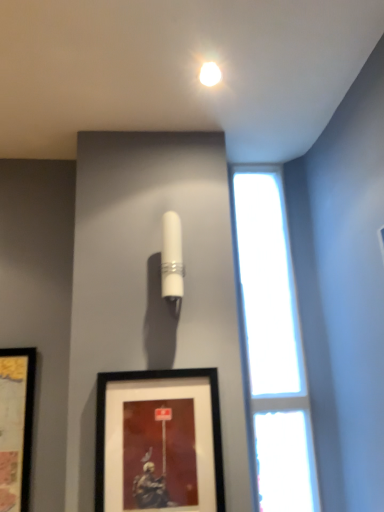
In order to face transparent glass window at right, should I rotate leftwards or rightwards?

To align with it, rotate right about 10.662°.

The height and width of the screenshot is (512, 384). Describe the element at coordinates (159, 441) in the screenshot. I see `black matte picture frame at lower center` at that location.

You are a GUI agent. You are given a task and a screenshot of the screen. Output one action in this format:
    pyautogui.click(x=<x>, y=<y>)
    Task: Click on the matte white light bulb at upper center
    The height and width of the screenshot is (512, 384).
    Given the screenshot: What is the action you would take?
    pyautogui.click(x=210, y=74)

Image resolution: width=384 pixels, height=512 pixels. In order to click on white glossy cylinder at upper center in this screenshot , I will do `click(172, 262)`.

Does point (175, 225) lie behind point (156, 469)?

Yes, it is behind point (156, 469).

Based on the photo, is white glossy cylinder at upper center far away from black matte picture frame at lower center?

white glossy cylinder at upper center is actually quite close to black matte picture frame at lower center.

Based on the photo, is white glossy cylinder at upper center surrounding black matte picture frame at lower center?

No.

In the image, is white glossy cylinder at upper center on the left side or the right side of black matte picture frame at lower center?

Clearly, white glossy cylinder at upper center is on the right of black matte picture frame at lower center in the image.

Looking at this image, considering the relative positions of matte white light bulb at upper center and black matte picture frame at lower center in the image provided, is matte white light bulb at upper center to the left or to the right of black matte picture frame at lower center?

matte white light bulb at upper center is to the right of black matte picture frame at lower center.

From a real-world perspective, does matte white light bulb at upper center sit lower than black matte picture frame at lower center?

No, from a real-world perspective, matte white light bulb at upper center is not under black matte picture frame at lower center.

Is point (206, 74) closer to viewer compared to point (103, 451)?

No, it is behind (103, 451).

Between matte white light bulb at upper center and black matte picture frame at lower center, which one has smaller size?

matte white light bulb at upper center is smaller.

Considering the positions of objects transparent glass window at right and white glossy cylinder at upper center in the image provided, who is in front, transparent glass window at right or white glossy cylinder at upper center?

white glossy cylinder at upper center is in front.

Where is `lamp above the transparent glass window at right (from a real-world perspective)`? This screenshot has height=512, width=384. lamp above the transparent glass window at right (from a real-world perspective) is located at coordinates (172, 262).

Is transparent glass window at right inside or outside of white glossy cylinder at upper center?

transparent glass window at right is not inside white glossy cylinder at upper center, it's outside.

Is transparent glass window at right next to matte white light bulb at upper center and touching it?

transparent glass window at right and matte white light bulb at upper center are not in contact.

Consider the image. Is transparent glass window at right inside the boundaries of matte white light bulb at upper center, or outside?

transparent glass window at right is located beyond the bounds of matte white light bulb at upper center.

From a real-world perspective, is transparent glass window at right physically located above or below matte white light bulb at upper center?

transparent glass window at right is situated lower than matte white light bulb at upper center in the real world.

Is transparent glass window at right in front of or behind matte white light bulb at upper center in the image?

transparent glass window at right is positioned farther from the viewer than matte white light bulb at upper center.

Which point is more forward, (274, 308) or (168, 453)?

The point (168, 453) is in front.

How far apart are transparent glass window at right and black matte picture frame at lower center?

A distance of 45.38 centimeters exists between transparent glass window at right and black matte picture frame at lower center.

I want to click on picture frame that appears below the transparent glass window at right (from the image's perspective), so click(x=159, y=441).

Considering the positions of objects transparent glass window at right and black matte picture frame at lower center in the image provided, who is more to the right, transparent glass window at right or black matte picture frame at lower center?

transparent glass window at right is more to the right.

Does matte white light bulb at upper center lie in front of white glossy cylinder at upper center?

Yes.

Find the location of a particular element. lighting located above the white glossy cylinder at upper center (from a real-world perspective) is located at coordinates click(x=210, y=74).

Would you say matte white light bulb at upper center is a long distance from white glossy cylinder at upper center?

No.

From a real-world perspective, is matte white light bulb at upper center physically above white glossy cylinder at upper center?

Yes.

The width and height of the screenshot is (384, 512). What are the coordinates of `picture frame on the left of matte white light bulb at upper center` in the screenshot? It's located at (159, 441).

Is black matte picture frame at lower center behind matte white light bulb at upper center?

That is False.

Is black matte picture frame at lower center far away from matte white light bulb at upper center?

Yes.

From a real-world perspective, is black matte picture frame at lower center on top of matte white light bulb at upper center?

No.

Where is `lamp lying above the black matte picture frame at lower center (from the image's perspective)`? The width and height of the screenshot is (384, 512). lamp lying above the black matte picture frame at lower center (from the image's perspective) is located at coordinates (172, 262).

Find the location of `lighting above the black matte picture frame at lower center (from a real-world perspective)`. lighting above the black matte picture frame at lower center (from a real-world perspective) is located at coordinates (210, 74).

Which object lies further to the anchor point black matte picture frame at lower center, white glossy cylinder at upper center or transparent glass window at right?

transparent glass window at right is further to black matte picture frame at lower center.

Looking at this image, considering their positions, is transparent glass window at right positioned closer to black matte picture frame at lower center than white glossy cylinder at upper center?

white glossy cylinder at upper center is closer to black matte picture frame at lower center.

In the scene shown: When comparing their distances from transparent glass window at right, does white glossy cylinder at upper center or black matte picture frame at lower center seem further?

white glossy cylinder at upper center lies further to transparent glass window at right than the other object.

Which object lies further to the anchor point matte white light bulb at upper center, transparent glass window at right or white glossy cylinder at upper center?

transparent glass window at right is further to matte white light bulb at upper center.

Based on their spatial positions, is black matte picture frame at lower center or transparent glass window at right further from matte white light bulb at upper center?

black matte picture frame at lower center is positioned further to the anchor matte white light bulb at upper center.

In the scene shown: Estimate the real-world distances between objects in this image. Which object is further from black matte picture frame at lower center, white glossy cylinder at upper center or matte white light bulb at upper center?

matte white light bulb at upper center is positioned further to the anchor black matte picture frame at lower center.

When comparing their distances from white glossy cylinder at upper center, does transparent glass window at right or black matte picture frame at lower center seem closer?

black matte picture frame at lower center is closer to white glossy cylinder at upper center.

In the scene shown: Based on their spatial positions, is black matte picture frame at lower center or matte white light bulb at upper center further from transparent glass window at right?

Based on the image, matte white light bulb at upper center appears to be further to transparent glass window at right.

Locate an element on the screen. The image size is (384, 512). window between matte white light bulb at upper center and black matte picture frame at lower center vertically is located at coordinates (273, 345).

This screenshot has height=512, width=384. Identify the location of lamp between matte white light bulb at upper center and transparent glass window at right in the vertical direction. (172, 262).

I want to click on window between white glossy cylinder at upper center and black matte picture frame at lower center in the up-down direction, so click(x=273, y=345).

You are a GUI agent. You are given a task and a screenshot of the screen. Output one action in this format:
    pyautogui.click(x=<x>, y=<y>)
    Task: Click on the lamp between matte white light bulb at upper center and black matte picture frame at lower center vertically
    
    Given the screenshot: What is the action you would take?
    pyautogui.click(x=172, y=262)